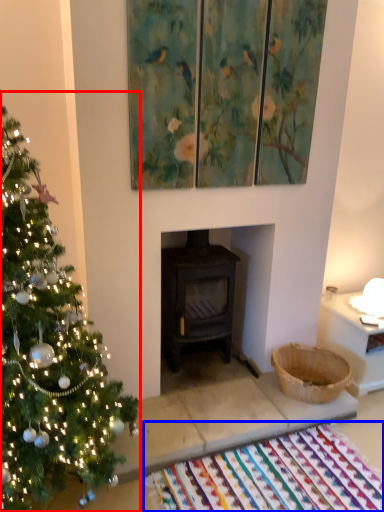
Question: Which object is further to the camera taking this photo, christmas tree (highlighted by a red box) or mat (highlighted by a blue box)?

Choices:
 (A) christmas tree
 (B) mat

Answer: (B)